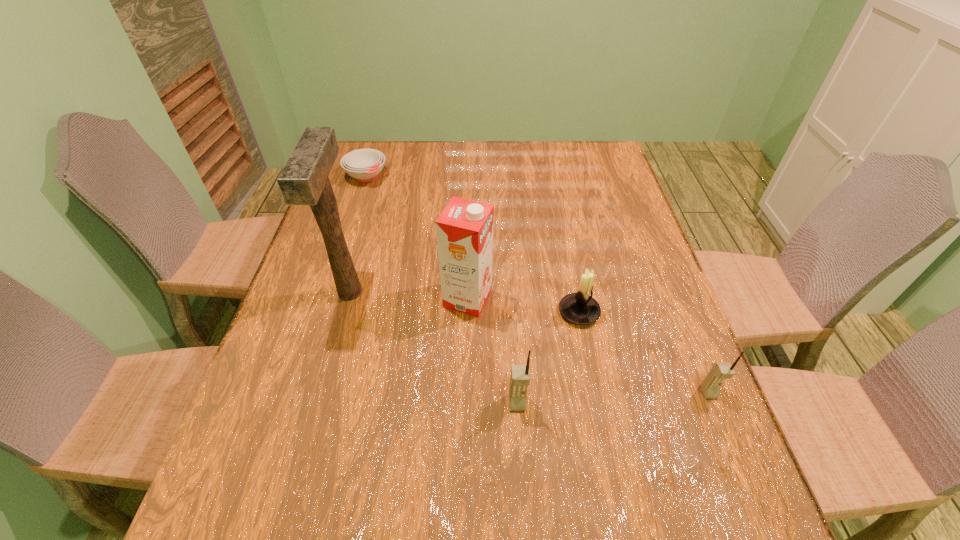
You are a GUI agent. You are given a task and a screenshot of the screen. Output one action in this format:
    pyautogui.click(x=<x>, y=<y>)
    Task: Click on the free space located on the front of the taller cellular telephone, where the keypad is located
    This screenshot has width=960, height=540.
    Given the screenshot: What is the action you would take?
    pyautogui.click(x=519, y=436)

This screenshot has width=960, height=540. I want to click on vacant space positioned on the front of the right cellular telephone, where the keypad is located, so pyautogui.click(x=721, y=423).

The image size is (960, 540). Find the location of `blank area located on the right of the farthest object`. blank area located on the right of the farthest object is located at coordinates (412, 177).

At what (x,y) coordinates should I click in order to perform the action: click on free location located on the back of the fourth object from right to left. Please return your answer as a coordinate pair (x, y). Looking at the image, I should click on (470, 199).

Where is `vacant space situated 0.160m on the right of the mallet`? vacant space situated 0.160m on the right of the mallet is located at coordinates (426, 293).

At what (x,y) coordinates should I click in order to perform the action: click on vacant area situated on the back of the candle holder. Please return your answer as a coordinate pair (x, y). Looking at the image, I should click on [x=560, y=214].

Identify the location of object at the far edge. The width and height of the screenshot is (960, 540). [x=364, y=165].

What are the coordinates of `soup bowl at the left edge` in the screenshot? It's located at (364, 165).

Identify the location of mallet at the left edge. (304, 180).

Find the location of a particular element. This screenshot has width=960, height=540. object situated at the right edge is located at coordinates (720, 371).